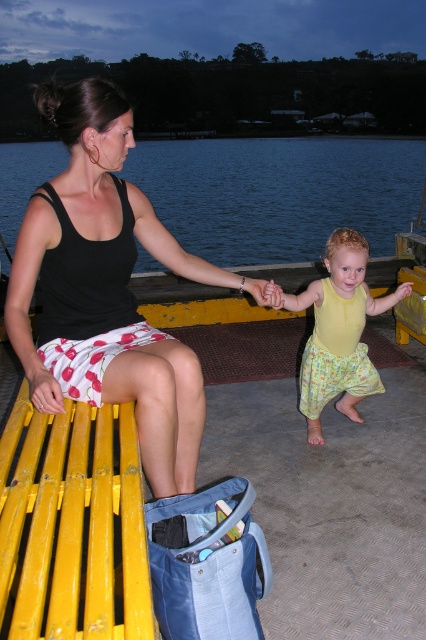
Question: Which object is positioned closest to the blue water at upper center?

Choices:
 (A) black matte tank top at left
 (B) yellow fabric pants at lower right

Answer: (B)

Question: Is blue water at upper center to the right of yellow fabric pants at lower right from the viewer's perspective?

Choices:
 (A) yes
 (B) no

Answer: (B)

Question: Is black matte tank top at left above blue water at upper center?

Choices:
 (A) yes
 (B) no

Answer: (B)

Question: Is blue water at upper center positioned behind yellow fabric pants at lower right?

Choices:
 (A) yes
 (B) no

Answer: (B)

Question: Which object appears farthest from the camera in this image?

Choices:
 (A) black matte tank top at left
 (B) yellow fabric pants at lower right
 (C) blue water at upper center

Answer: (B)

Question: Among these points, which one is farthest from the camera?

Choices:
 (A) (325, 358)
 (B) (186, 179)
 (C) (143, 332)

Answer: (B)